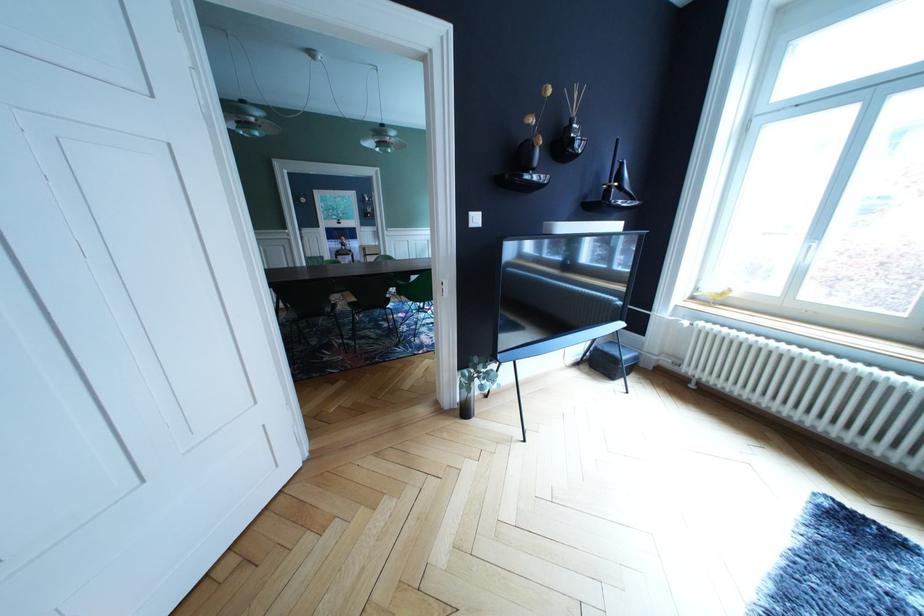
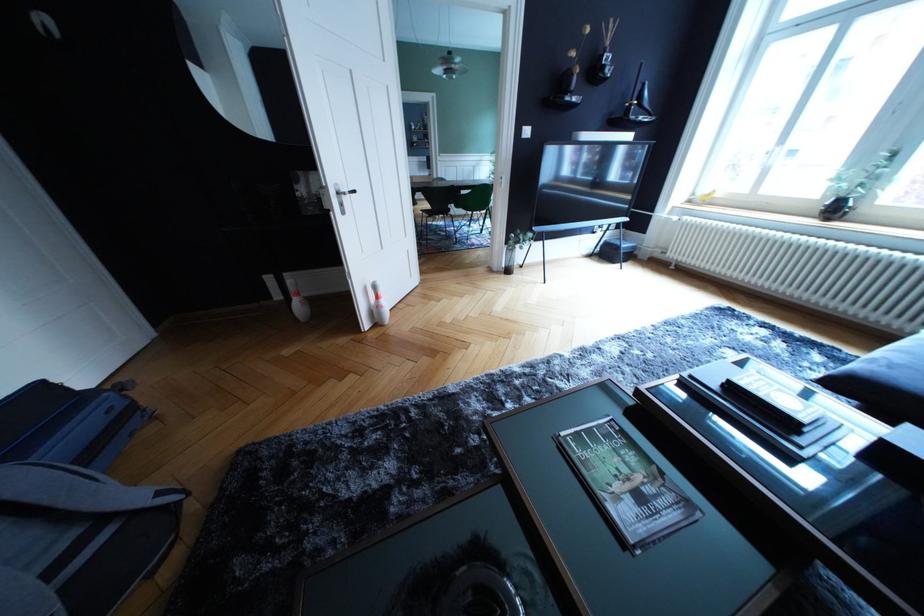
Question: In a continuous first-person perspective shot, in which direction is the camera moving?

Choices:
 (A) Left
 (B) Right
 (C) Forward
 (D) Backward

Answer: (D)